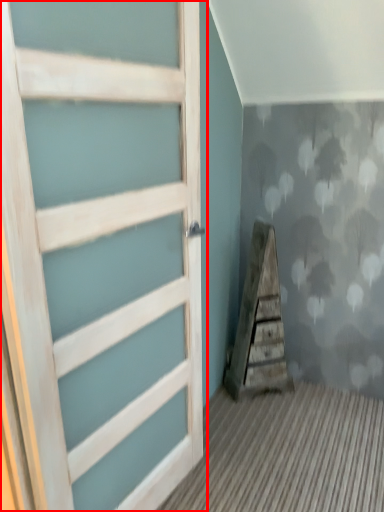
Question: Observing the image, what is the correct spatial positioning of door (annotated by the red box) in reference to stairwell?

Choices:
 (A) left
 (B) right

Answer: (A)